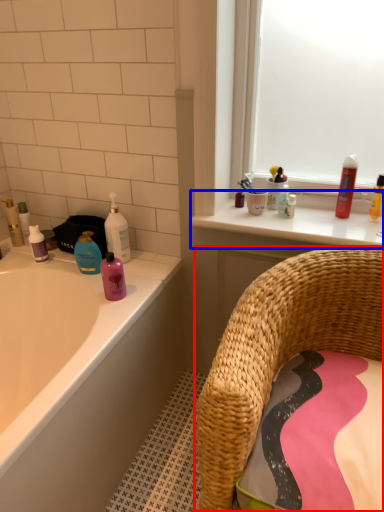
Question: Which of the following is the farthest to the observer, chair (highlighted by a red box) or counter top (highlighted by a blue box)?

Choices:
 (A) chair
 (B) counter top

Answer: (B)